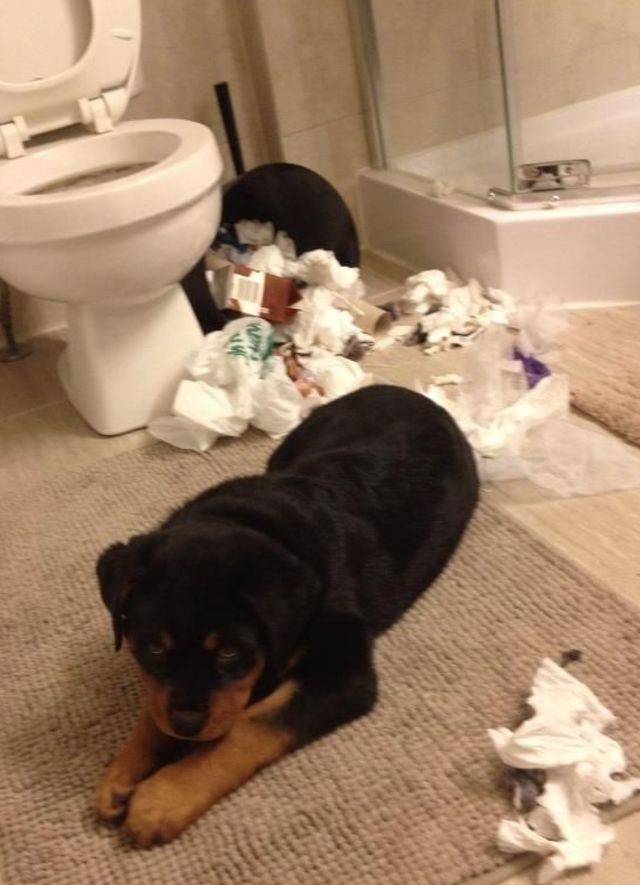
Locate an element on the screen. The width and height of the screenshot is (640, 885). shower curb is located at coordinates (580, 234), (472, 255).